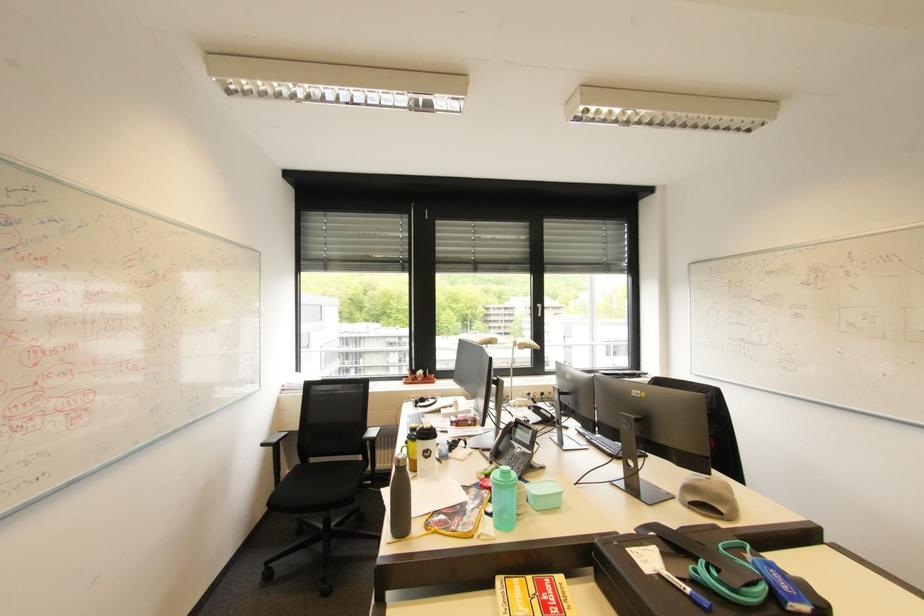
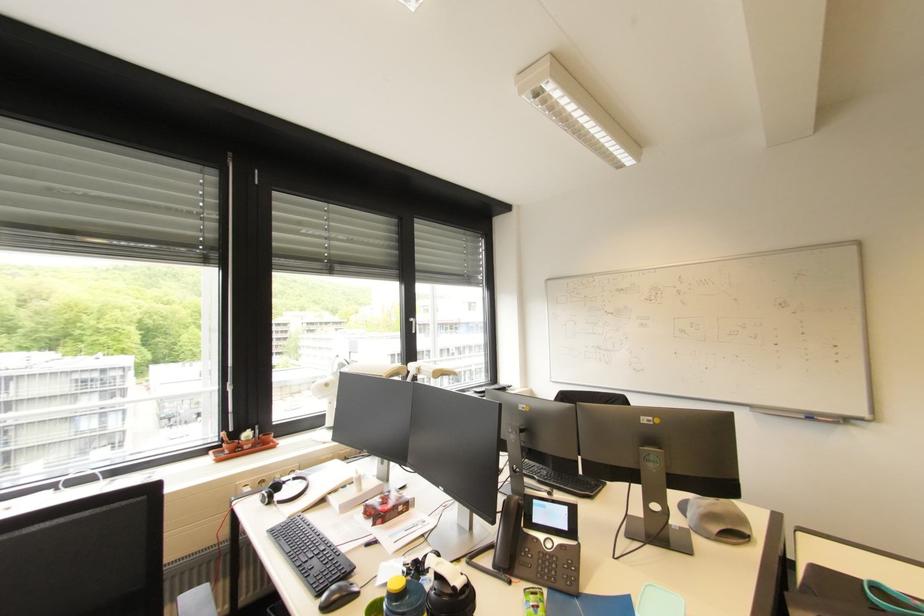
Find the pixel in the second image that matches (x=424, y=374) in the first image.

(252, 438)